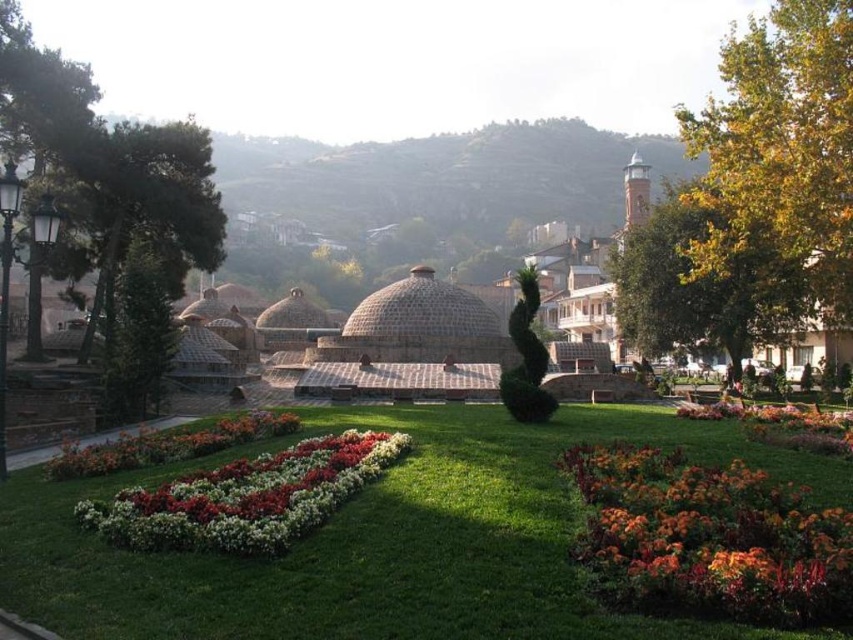
In the scene shown: You are standing at the center of the lawn in the park and want to find the orange textured flowers at lower right. According to the coordinates provided, which direction should you walk to locate them?

The orange textured flowers at lower right are located at coordinates point (x=708, y=538), which is towards the lower right direction from your current position at the center of the lawn.

In the scene shown: You are a gardener who wants to place a new decorative stone between the green grass at center and the multicolored fabric flower at lower right. Based on their positions, where should you place the stone to ensure it is exactly between them?

The green grass at center is to the left of the multicolored fabric flower at lower right, so placing the stone halfway between them would mean positioning it to the right of the green grass at center and to the left of the multicolored fabric flower at lower right.

You are planning to install a sprinkler system in the park. The sprinkler can water an area up to 20 feet in radius. If you place the sprinkler at the green grass at center, will it reach the orange textured flowers at lower right?

The distance between the green grass at center and orange textured flowers at lower right is 19.32 feet, which is within the 20 feet radius of the sprinkler. Therefore, placing the sprinkler at the green grass at center will successfully water the orange textured flowers at lower right.